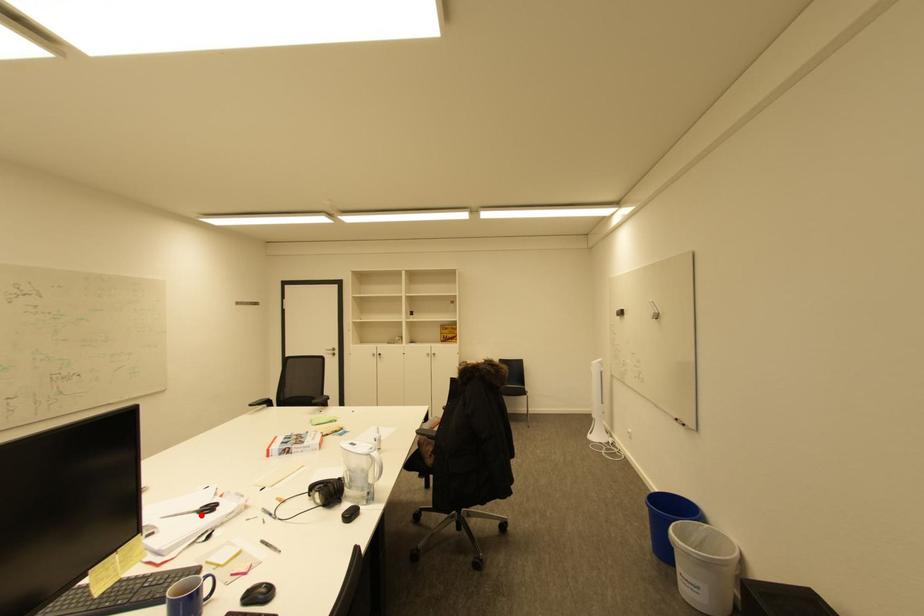
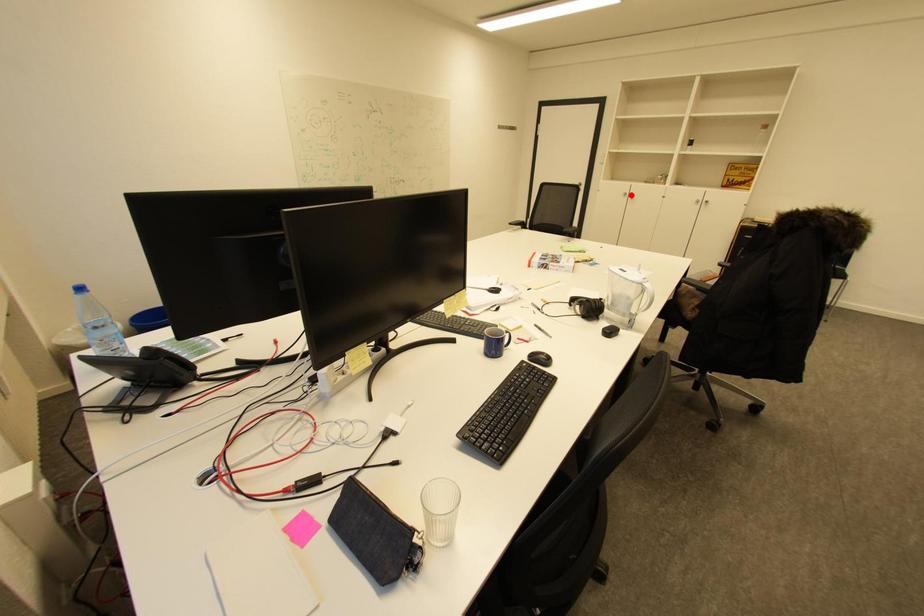
I am providing you with two images of the same scene from different viewpoints. A red point is marked on the first image and another point is marked on the second image. Is the marked point in image1 the same physical position as the marked point in image2?

No